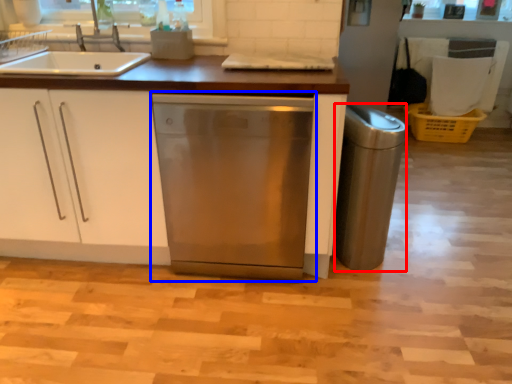
Question: Which object appears farthest to the camera in this image, appliance (highlighted by a red box) or home appliance (highlighted by a blue box)?

Choices:
 (A) appliance
 (B) home appliance

Answer: (A)